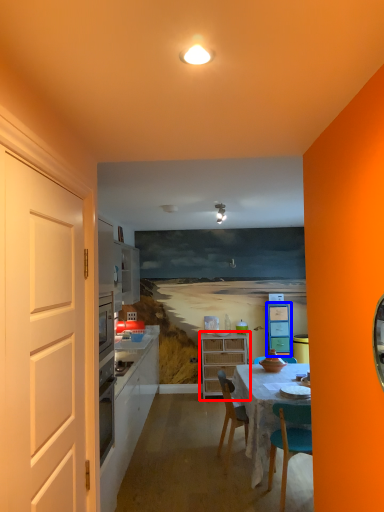
Question: Among these objects, which one is farthest to the camera, cabinetry (highlighted by a red box) or cabinetry (highlighted by a blue box)?

Choices:
 (A) cabinetry
 (B) cabinetry

Answer: (B)